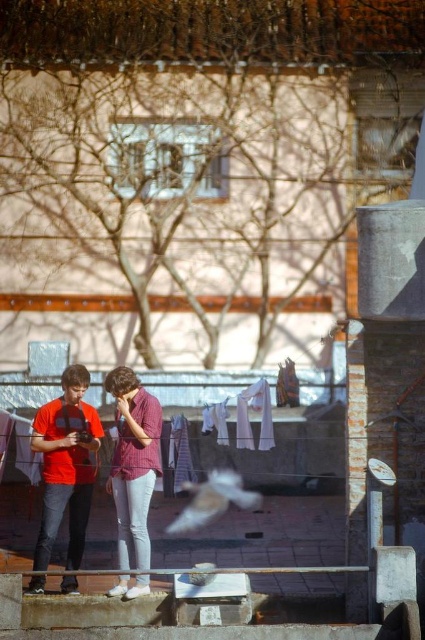
From the picture: You are a photographer standing on a rooftop terrace. You see a matte red shirt at center and a white feathered bird at center. Which object is positioned to the right side of the other?

The white feathered bird at center is positioned to the right of the matte red shirt at center.